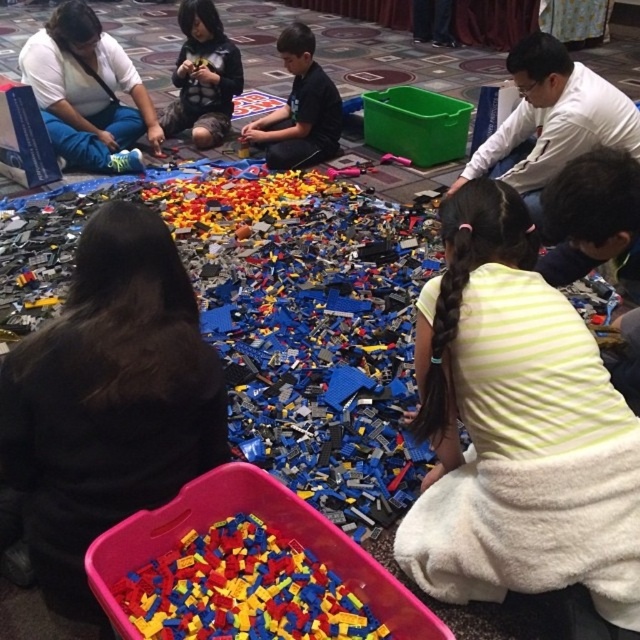
You are standing in the LEGO workshop and want to pick up the LEGO piece at point (166, 563) and the one at point (54, 109). Which one will you reach first if you move towards them?

You will reach the LEGO piece at point (166, 563) first because it is closer to you than the LEGO piece at point (54, 109).